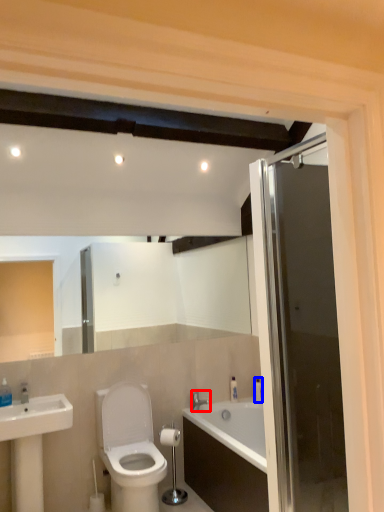
Question: Among these objects, which one is farthest to the camera, tap (highlighted by a red box) or toiletry (highlighted by a blue box)?

Choices:
 (A) tap
 (B) toiletry

Answer: (B)